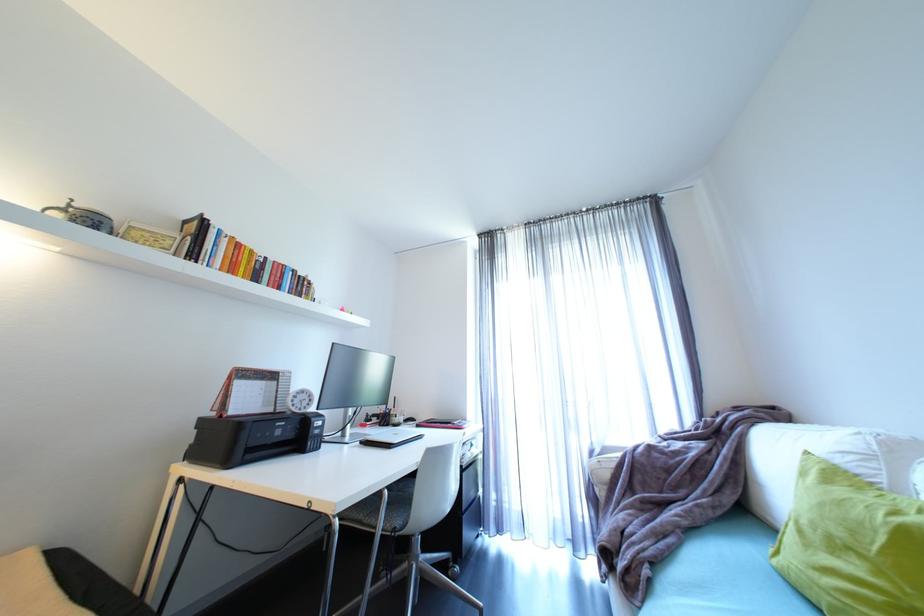
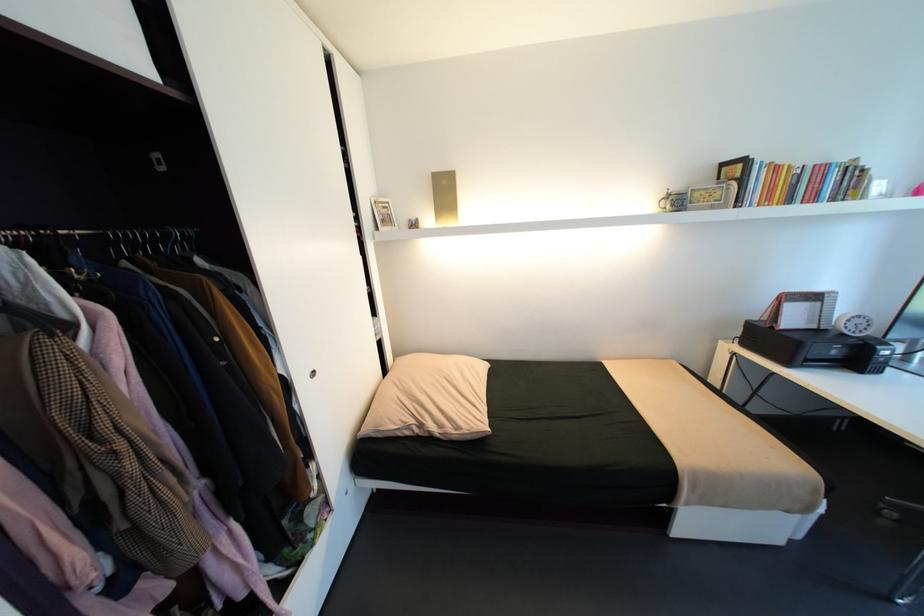
Find the pixel in the second image that matches (x=82, y=205) in the first image.

(676, 192)